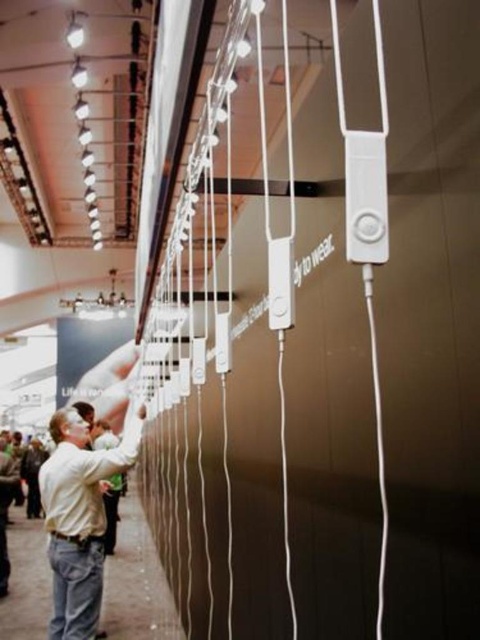
Does white matte shirt at center appear under light beige shirt at lower left?

No, white matte shirt at center is not below light beige shirt at lower left.

Who is more forward, (86, 465) or (3, 572)?

Point (86, 465) is more forward.

Is point (54, 524) closer to viewer compared to point (2, 589)?

Yes, it is.

Locate an element on the screen. The image size is (480, 640). white matte shirt at center is located at coordinates (79, 518).